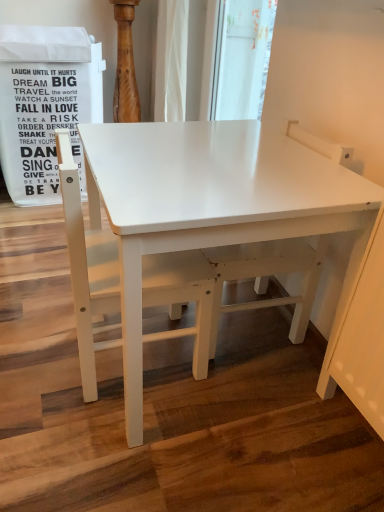
Question: Is white matte swivel chair at center far from white matte chair at left?

Choices:
 (A) no
 (B) yes

Answer: (A)

Question: From a real-world perspective, is white matte swivel chair at center physically below white matte chair at left?

Choices:
 (A) yes
 (B) no

Answer: (A)

Question: From a real-world perspective, is white matte swivel chair at center on white matte chair at left?

Choices:
 (A) yes
 (B) no

Answer: (B)

Question: Does white matte swivel chair at center have a lesser width compared to white matte chair at left?

Choices:
 (A) yes
 (B) no

Answer: (A)

Question: Is the depth of white matte swivel chair at center less than that of white matte chair at left?

Choices:
 (A) yes
 (B) no

Answer: (B)

Question: In the image, is white matte table at center on the left side or the right side of white matte swivel chair at center?

Choices:
 (A) right
 (B) left

Answer: (B)

Question: Is point (134, 378) positioned closer to the camera than point (273, 256)?

Choices:
 (A) farther
 (B) closer

Answer: (B)

Question: Looking at their shapes, would you say white matte table at center is wider or thinner than white matte swivel chair at center?

Choices:
 (A) thin
 (B) wide

Answer: (B)

Question: Choose the correct answer: Is white matte table at center inside white matte swivel chair at center or outside it?

Choices:
 (A) inside
 (B) outside

Answer: (B)

Question: Considering the positions of white matte swivel chair at center and white matte chair at left in the image, is white matte swivel chair at center bigger or smaller than white matte chair at left?

Choices:
 (A) big
 (B) small

Answer: (A)

Question: In terms of height, does white matte swivel chair at center look taller or shorter compared to white matte chair at left?

Choices:
 (A) short
 (B) tall

Answer: (B)

Question: Would you say white matte swivel chair at center is inside or outside white matte chair at left?

Choices:
 (A) outside
 (B) inside

Answer: (A)

Question: From the image's perspective, is white matte swivel chair at center above or below white matte chair at left?

Choices:
 (A) above
 (B) below

Answer: (A)

Question: Is white matte chair at left to the left or to the right of white matte swivel chair at center in the image?

Choices:
 (A) right
 (B) left

Answer: (B)

Question: Is white matte chair at left spatially inside white matte swivel chair at center, or outside of it?

Choices:
 (A) inside
 (B) outside

Answer: (B)